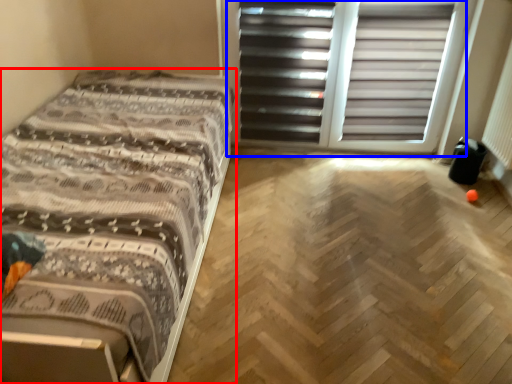
Question: Which object appears closest to the camera in this image, bed (highlighted by a red box) or screen door (highlighted by a blue box)?

Choices:
 (A) bed
 (B) screen door

Answer: (A)